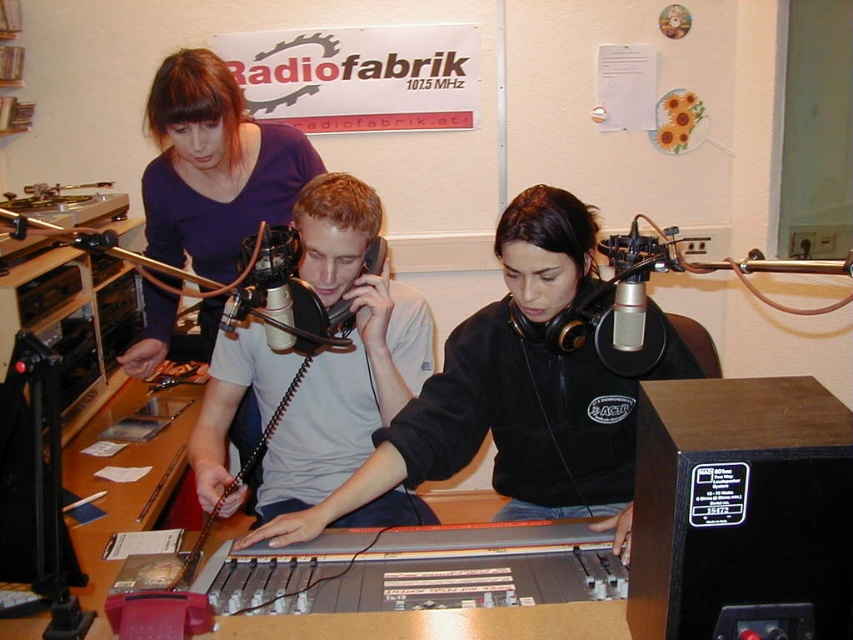
Question: In this image, where is white matte shirt at center located relative to matte purple shirt at upper left?

Choices:
 (A) left
 (B) right

Answer: (B)

Question: Considering the real-world distances, which object is closest to the white matte shirt at center?

Choices:
 (A) matte purple shirt at upper left
 (B) matte gray shirt at center

Answer: (B)

Question: Which point appears closest to the camera in this image?

Choices:
 (A) (357, 320)
 (B) (148, 300)
 (C) (572, 458)

Answer: (C)

Question: In this image, where is white matte shirt at center located relative to matte purple shirt at upper left?

Choices:
 (A) above
 (B) below

Answer: (B)

Question: Which of the following is the farthest from the observer?

Choices:
 (A) (207, 488)
 (B) (146, 337)

Answer: (B)

Question: Is matte gray shirt at center bigger than white matte shirt at center?

Choices:
 (A) yes
 (B) no

Answer: (A)